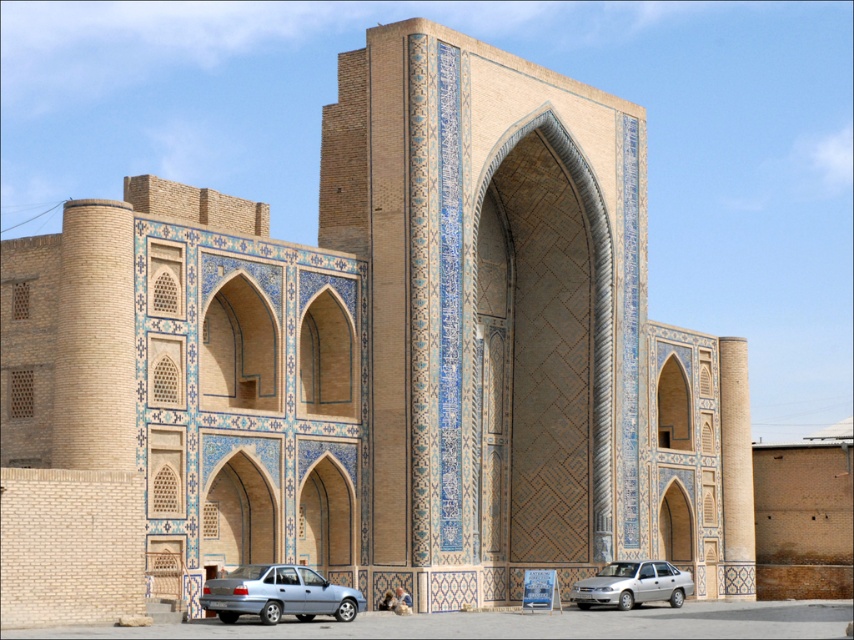
Does silver metallic sedan at lower center come in front of silver metallic car at lower center?

Yes.

Which is behind, point (231, 586) or point (661, 592)?

The point (661, 592) is more distant.

You are a GUI agent. You are given a task and a screenshot of the screen. Output one action in this format:
    pyautogui.click(x=<x>, y=<y>)
    Task: Click on the silver metallic sedan at lower center
    
    Given the screenshot: What is the action you would take?
    pyautogui.click(x=278, y=595)

Locate an element on the screen. silver metallic sedan at lower center is located at coordinates (278, 595).